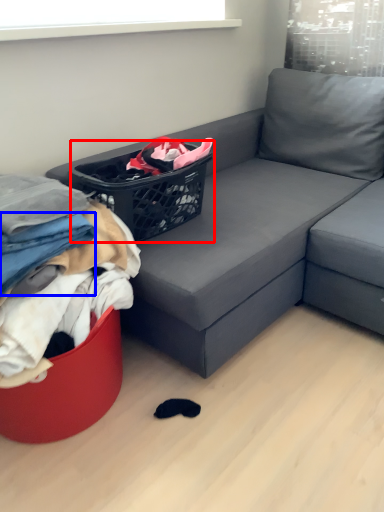
Question: Which point is closer to the camera, basket (highlighted by a red box) or clothing (highlighted by a blue box)?

Choices:
 (A) basket
 (B) clothing

Answer: (B)